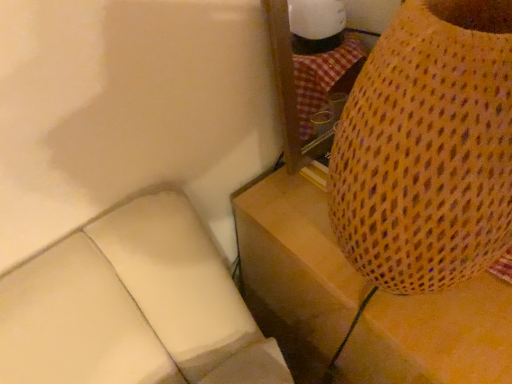
Locate an element on the screen. orange mesh lampshade at right is located at coordinates (294, 245).

This screenshot has width=512, height=384. What do you see at coordinates (294, 245) in the screenshot?
I see `orange mesh lampshade at right` at bounding box center [294, 245].

At what (x,y) coordinates should I click in order to perform the action: click on orange mesh lampshade at right. Please return your answer as a coordinate pair (x, y). This screenshot has width=512, height=384. Looking at the image, I should click on (294, 245).